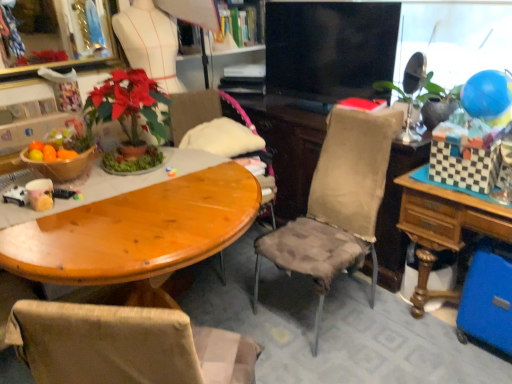
Where is `free space above black glossy tv at center (from a real-world perspective)`? Image resolution: width=512 pixels, height=384 pixels. free space above black glossy tv at center (from a real-world perspective) is located at coordinates (340, 1).